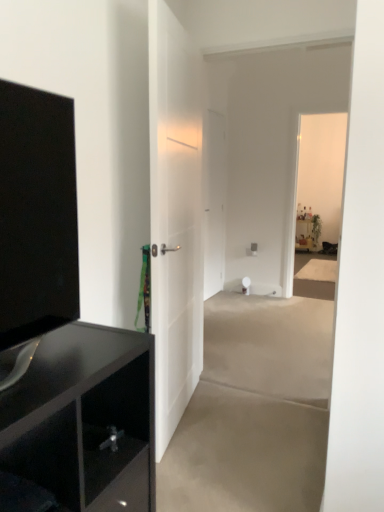
Question: Does white matte door at center, acting as the second door starting from the right, have a lesser width compared to gray matte concrete at center, placed as the first concrete when sorted from front to back?

Choices:
 (A) no
 (B) yes

Answer: (B)

Question: From a real-world perspective, is white matte door at center, acting as the second door starting from the right, located beneath gray matte concrete at center, placed as the first concrete when sorted from front to back?

Choices:
 (A) yes
 (B) no

Answer: (B)

Question: Is white matte door at center, acting as the second door starting from the right, next to gray matte concrete at center, positioned as the 2th concrete in back-to-front order?

Choices:
 (A) no
 (B) yes

Answer: (A)

Question: Are white matte door at center, which is the 1th door in left-to-right order, and gray matte concrete at center, placed as the first concrete when sorted from front to back, located far from each other?

Choices:
 (A) no
 (B) yes

Answer: (A)

Question: From the image's perspective, is white matte door at center, which is the first door in front-to-back order, over gray matte concrete at center, which ranks as the 2th concrete in top-to-bottom order?

Choices:
 (A) yes
 (B) no

Answer: (A)

Question: In the image, is smooth beige carpet at center, the 1th concrete viewed from the back, on the left side or the right side of white matte door at center, acting as the second door starting from the right?

Choices:
 (A) left
 (B) right

Answer: (B)

Question: Is smooth beige carpet at center, which is counted as the first concrete, starting from the top, spatially inside white matte door at center, the 2th door when ordered from back to front, or outside of it?

Choices:
 (A) inside
 (B) outside

Answer: (B)

Question: From their relative heights in the image, would you say smooth beige carpet at center, the 1th concrete viewed from the back, is taller or shorter than white matte door at center, acting as the second door starting from the right?

Choices:
 (A) tall
 (B) short

Answer: (B)

Question: Is smooth beige carpet at center, which ranks as the 2th concrete in bottom-to-top order, bigger or smaller than white matte door at center, the 2th door when ordered from back to front?

Choices:
 (A) small
 (B) big

Answer: (B)

Question: Is white matte door at center, the 2th door when ordered from back to front, taller or shorter than smooth beige carpet at center, which is counted as the first concrete, starting from the top?

Choices:
 (A) tall
 (B) short

Answer: (A)

Question: Is white matte door at center, acting as the second door starting from the right, spatially inside smooth beige carpet at center, the 1th concrete viewed from the back, or outside of it?

Choices:
 (A) inside
 (B) outside

Answer: (B)

Question: From a real-world perspective, relative to smooth beige carpet at center, the 1th concrete viewed from the back, is white matte door at center, the 2th door when ordered from back to front, vertically above or below?

Choices:
 (A) above
 (B) below

Answer: (A)

Question: Relative to smooth beige carpet at center, the second concrete from the front, is white matte door at center, the 2th door when ordered from back to front, in front or behind?

Choices:
 (A) front
 (B) behind

Answer: (A)

Question: In terms of width, does gray matte concrete at center, marked as the 1th concrete in a bottom-to-top arrangement, look wider or thinner when compared to white glossy door at center, marked as the 2th door in a left-to-right arrangement?

Choices:
 (A) wide
 (B) thin

Answer: (A)

Question: From the image's perspective, is gray matte concrete at center, positioned as the 2th concrete in back-to-front order, positioned above or below white glossy door at center, marked as the 2th door in a left-to-right arrangement?

Choices:
 (A) above
 (B) below

Answer: (B)